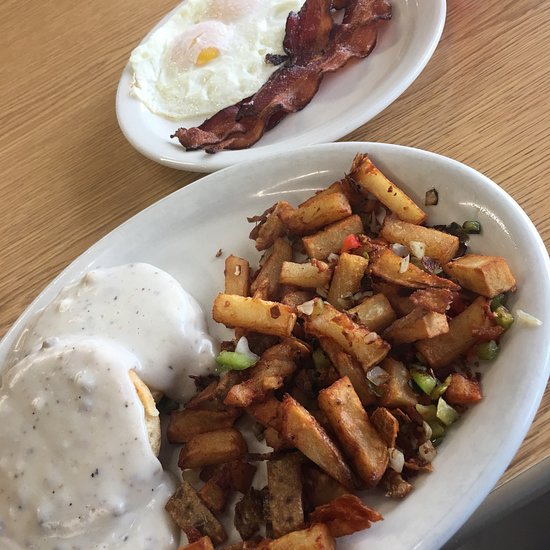
Identify the location of plate. The width and height of the screenshot is (550, 550). (380, 101).